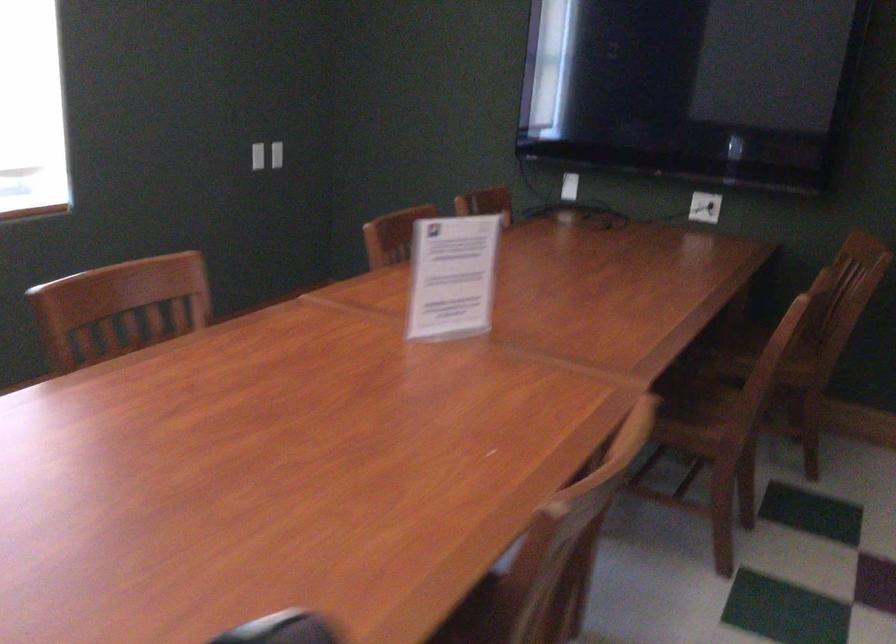
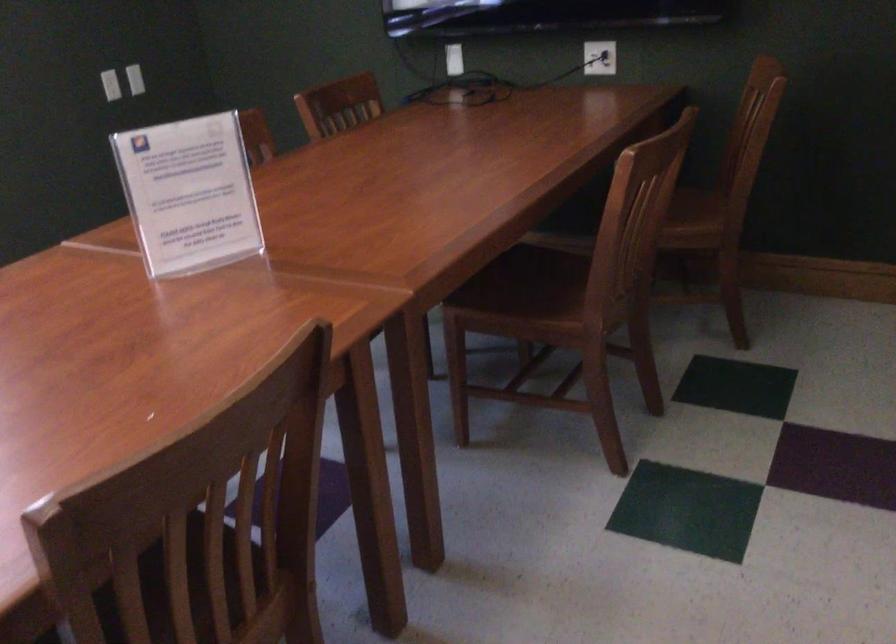
Locate, in the second image, the point that corresponds to point 280,156 in the first image.

(134, 79)